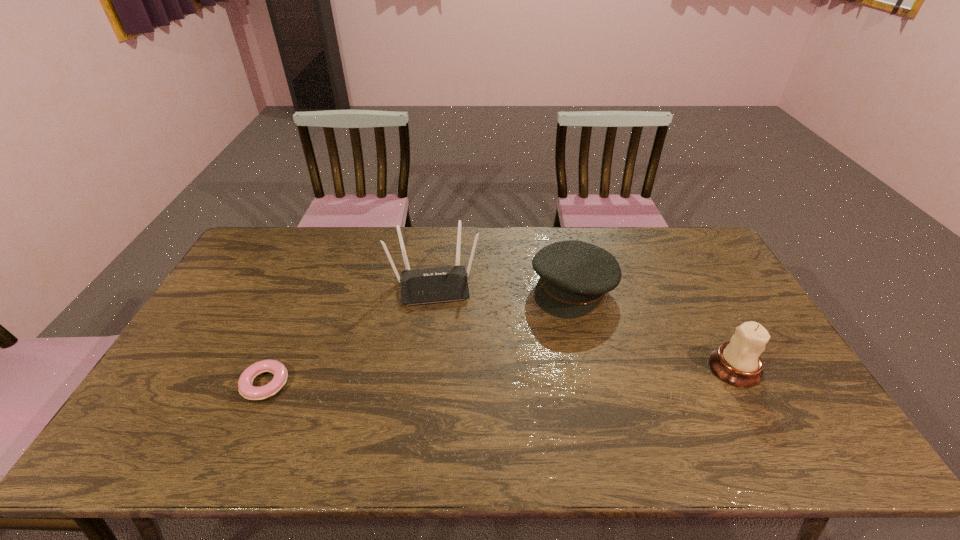
Image resolution: width=960 pixels, height=540 pixels. I want to click on the leftmost object, so click(246, 389).

Locate an element on the screen. the shortest object is located at coordinates (246, 389).

Find the location of `candle holder`. candle holder is located at coordinates (738, 362).

Where is `the third tallest object`? the third tallest object is located at coordinates (574, 275).

Image resolution: width=960 pixels, height=540 pixels. Find the location of `beret`. beret is located at coordinates (574, 275).

Identify the location of router. The width and height of the screenshot is (960, 540). (430, 285).

Locate an element on the screen. The width and height of the screenshot is (960, 540). vacant region located on the left of the doughnut is located at coordinates [216, 384].

Image resolution: width=960 pixels, height=540 pixels. Find the location of `vacant space located 0.080m on the front of the candle holder`. vacant space located 0.080m on the front of the candle holder is located at coordinates (760, 416).

At what (x,y) coordinates should I click in order to perform the action: click on vacant space situated on the front-facing side of the second object from right to left. Please return your answer as a coordinate pair (x, y). The height and width of the screenshot is (540, 960). Looking at the image, I should click on (532, 334).

Where is `vacant space located 0.160m on the front-facing side of the second object from right to left`? The width and height of the screenshot is (960, 540). vacant space located 0.160m on the front-facing side of the second object from right to left is located at coordinates (522, 345).